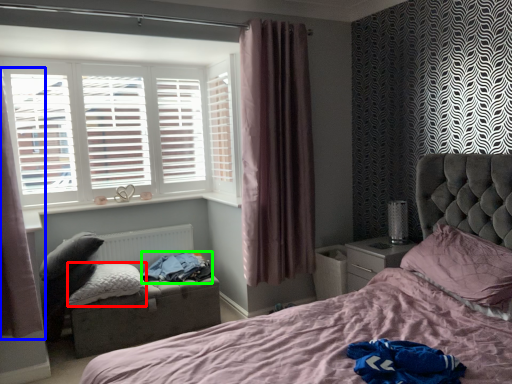
Question: Which object is the closest to the pillow (highlighted by a red box)? Choose among these: curtain (highlighted by a blue box) or clothing (highlighted by a green box).

Choices:
 (A) curtain
 (B) clothing

Answer: (B)